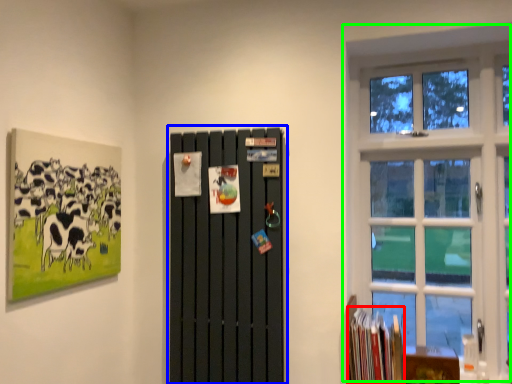
Question: Which is farther away from book (highlighted by a red box)? barn door (highlighted by a blue box) or window (highlighted by a green box)?

Choices:
 (A) barn door
 (B) window

Answer: (B)